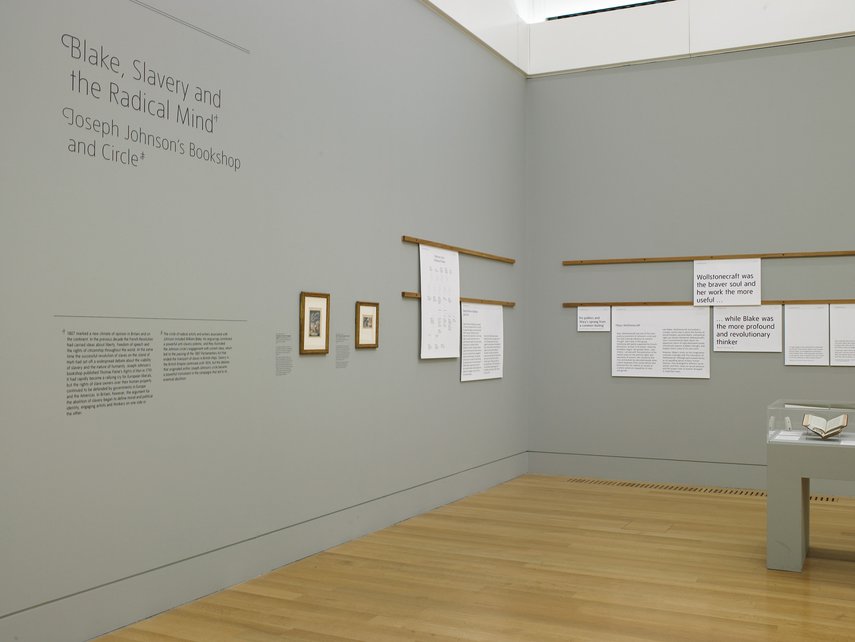
Identify the location of 1 book in display case. (835, 426).